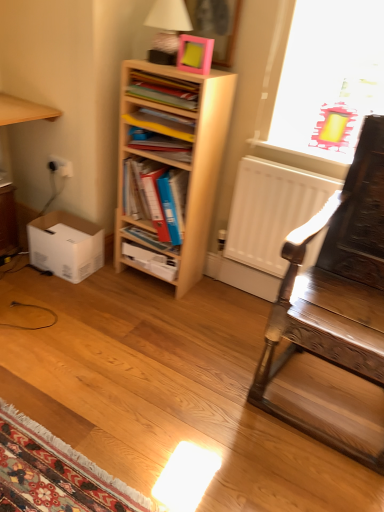
Question: Considering the relative sizes of pink matte picture frame at upper center and white cardboard box at lower left in the image provided, is pink matte picture frame at upper center shorter than white cardboard box at lower left?

Choices:
 (A) no
 (B) yes

Answer: (B)

Question: Is there a large distance between pink matte picture frame at upper center and white cardboard box at lower left?

Choices:
 (A) no
 (B) yes

Answer: (B)

Question: Is pink matte picture frame at upper center outside of white cardboard box at lower left?

Choices:
 (A) no
 (B) yes

Answer: (B)

Question: From the image's perspective, is pink matte picture frame at upper center under white cardboard box at lower left?

Choices:
 (A) yes
 (B) no

Answer: (B)

Question: From a real-world perspective, is pink matte picture frame at upper center under white cardboard box at lower left?

Choices:
 (A) no
 (B) yes

Answer: (A)

Question: Choose the correct answer: Is matte white table lamp at upper center inside light wood bookshelf at center or outside it?

Choices:
 (A) inside
 (B) outside

Answer: (B)

Question: Is point click(182, 8) positioned closer to the camera than point click(200, 174)?

Choices:
 (A) closer
 (B) farther

Answer: (A)

Question: Based on their sizes in the image, would you say matte white table lamp at upper center is bigger or smaller than light wood bookshelf at center?

Choices:
 (A) big
 (B) small

Answer: (B)

Question: In the image, is matte white table lamp at upper center on the left side or the right side of light wood bookshelf at center?

Choices:
 (A) left
 (B) right

Answer: (B)

Question: Is white matte radiator at center to the left or to the right of white cardboard box at lower left in the image?

Choices:
 (A) right
 (B) left

Answer: (A)

Question: Is point (309, 212) closer or farther from the camera than point (67, 271)?

Choices:
 (A) closer
 (B) farther

Answer: (A)

Question: From the image's perspective, is white matte radiator at center positioned above or below white cardboard box at lower left?

Choices:
 (A) above
 (B) below

Answer: (A)

Question: From a real-world perspective, is white matte radiator at center physically located above or below white cardboard box at lower left?

Choices:
 (A) below
 (B) above

Answer: (B)

Question: Is point (145, 87) positioned closer to the camera than point (170, 238)?

Choices:
 (A) farther
 (B) closer

Answer: (B)

Question: From a real-world perspective, is matte plastic book at upper center, which is the 5th book in bottom-to-top order, physically located above or below blue plastic folder at center, which ranks as the third book in bottom-to-top order?

Choices:
 (A) below
 (B) above

Answer: (B)